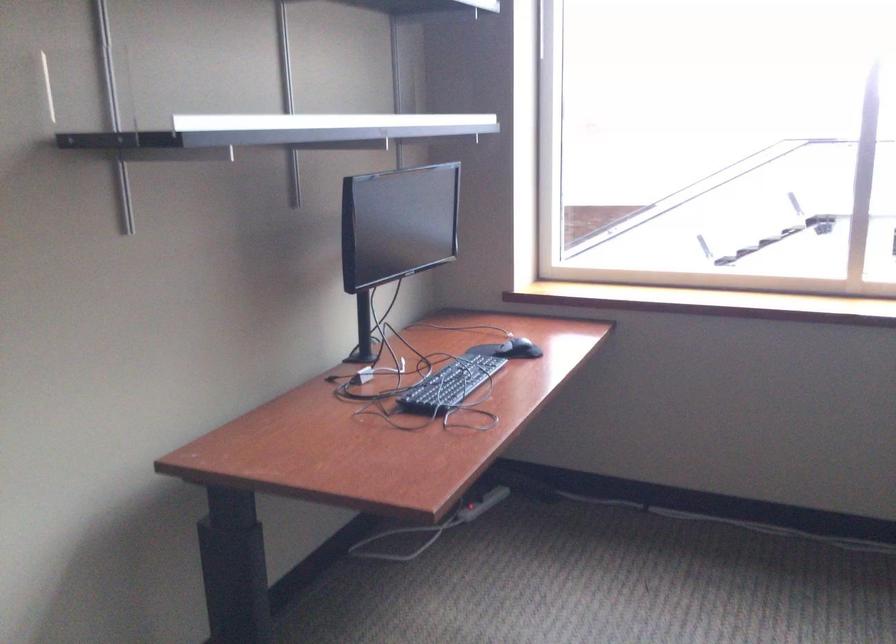
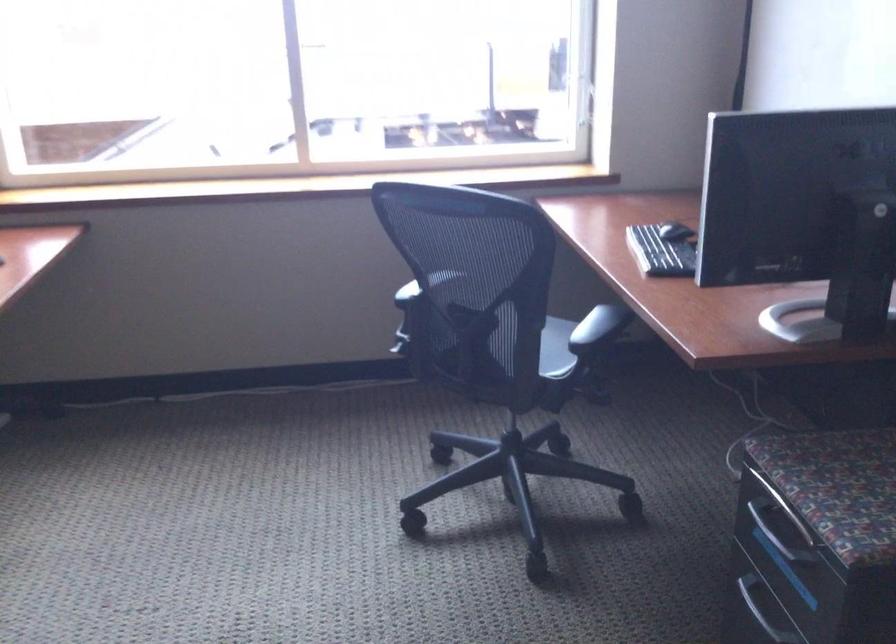
Question: How did the camera likely rotate?

Choices:
 (A) Left
 (B) Right
 (C) Up
 (D) Down

Answer: (B)